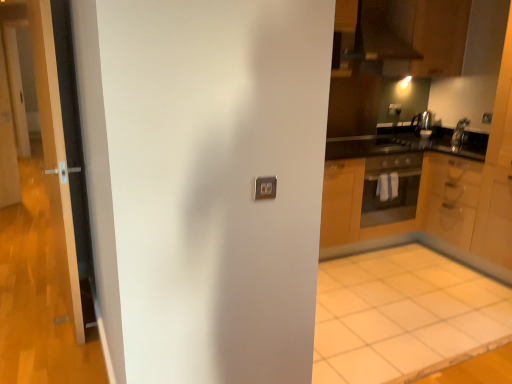
Question: Is wooden cabinet at center, which is the 1th cabinetry in left-to-right order, looking in the opposite direction of satin silver kettle at upper right, the first appliance positioned from the right?

Choices:
 (A) yes
 (B) no

Answer: (B)

Question: Could you tell me if wooden cabinet at center, which is the 1th cabinetry in left-to-right order, is turned towards satin silver kettle at upper right, the first appliance positioned from the right?

Choices:
 (A) no
 (B) yes

Answer: (A)

Question: Can you confirm if wooden cabinet at center, the second cabinetry viewed from the right, is thinner than satin silver kettle at upper right, the first appliance from the front?

Choices:
 (A) no
 (B) yes

Answer: (A)

Question: Is wooden cabinet at center, which is the 1th cabinetry in left-to-right order, not within satin silver kettle at upper right, the first appliance from the front?

Choices:
 (A) yes
 (B) no

Answer: (A)

Question: Does wooden cabinet at center, the second cabinetry viewed from the right, have a smaller size compared to satin silver kettle at upper right, the 2th appliance when ordered from back to front?

Choices:
 (A) yes
 (B) no

Answer: (B)

Question: From a real-world perspective, is wooden cabinet at center, the second cabinetry viewed from the right, beneath satin silver kettle at upper right, the first appliance positioned from the right?

Choices:
 (A) yes
 (B) no

Answer: (A)

Question: Is wooden cabinet at center, which is the 1th cabinetry in left-to-right order, in front of satin silver exhaust hood at upper center?

Choices:
 (A) yes
 (B) no

Answer: (B)

Question: Is wooden cabinet at center, the second cabinetry viewed from the right, at the left side of satin silver exhaust hood at upper center?

Choices:
 (A) no
 (B) yes

Answer: (A)

Question: Considering the relative sizes of wooden cabinet at center, which is the 1th cabinetry in left-to-right order, and satin silver exhaust hood at upper center in the image provided, is wooden cabinet at center, which is the 1th cabinetry in left-to-right order, wider than satin silver exhaust hood at upper center?

Choices:
 (A) yes
 (B) no

Answer: (B)

Question: From the image's perspective, is wooden cabinet at center, the second cabinetry viewed from the right, beneath satin silver exhaust hood at upper center?

Choices:
 (A) yes
 (B) no

Answer: (A)

Question: From a real-world perspective, is wooden cabinet at center, the second cabinetry viewed from the right, beneath satin silver exhaust hood at upper center?

Choices:
 (A) no
 (B) yes

Answer: (B)

Question: Can you confirm if wooden cabinet at center, which is the 1th cabinetry in left-to-right order, is bigger than satin silver exhaust hood at upper center?

Choices:
 (A) yes
 (B) no

Answer: (A)

Question: Is the surface of wooden cabinet at right, which ranks as the first cabinetry in right-to-left order, in direct contact with white tile floor at lower right?

Choices:
 (A) yes
 (B) no

Answer: (B)